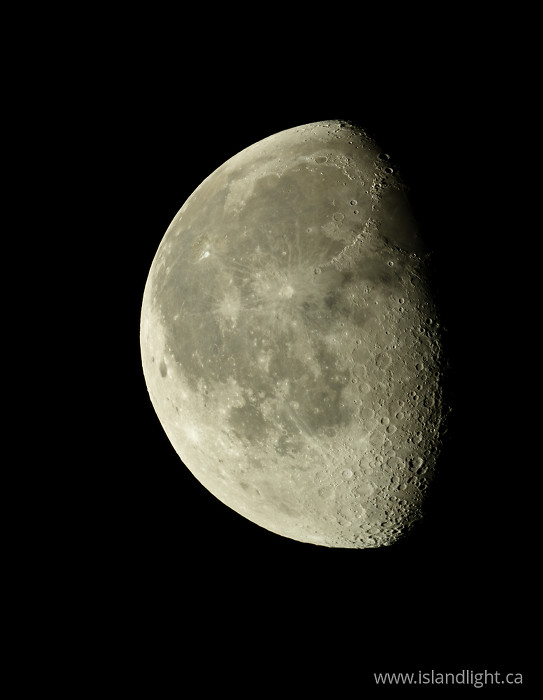
Locate an element on the screen. Image resolution: width=543 pixels, height=700 pixels. corner is located at coordinates (529, 691), (12, 687), (11, 10), (532, 12).